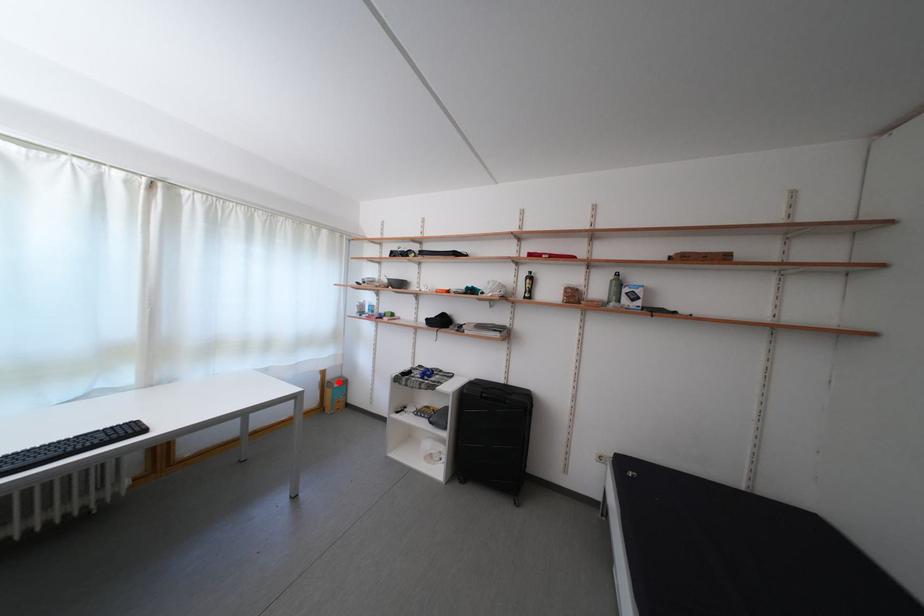
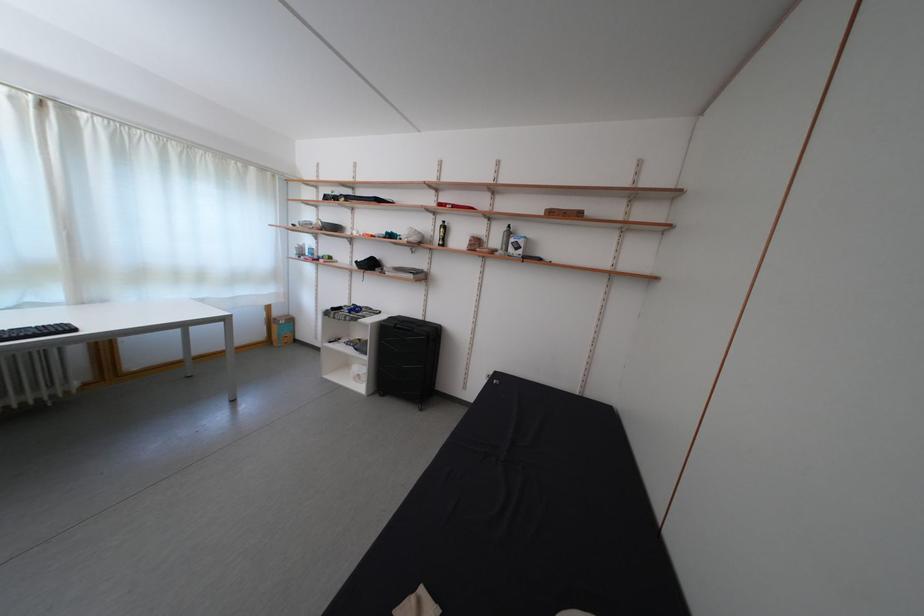
In the second image, find the point that corresponds to the highlighted location in the first image.

(285, 320)